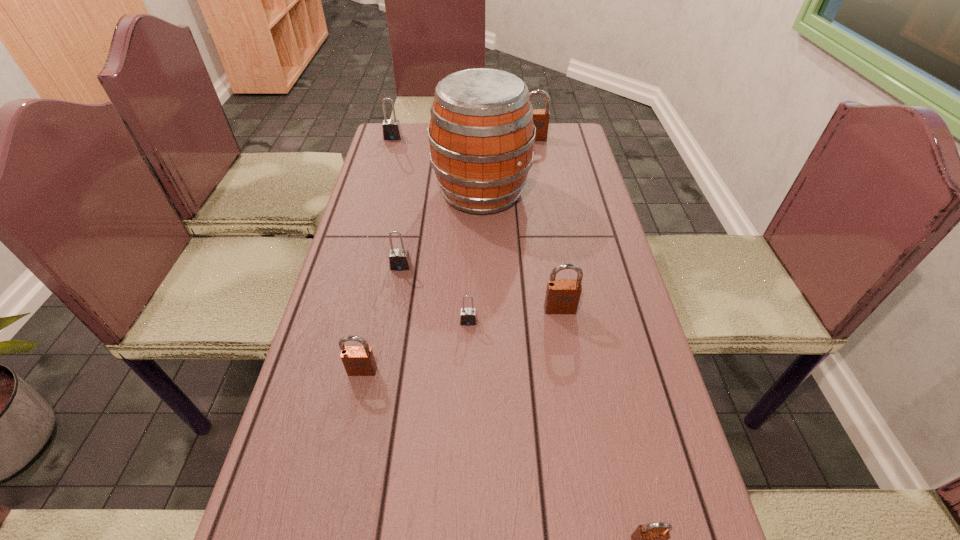
You are a GUI agent. You are given a task and a screenshot of the screen. Output one action in this format:
    pyautogui.click(x=<x>, y=<y>)
    Task: Click on the gray padlock that can be found as the closest to the second farthest brown padlock
    
    Given the screenshot: What is the action you would take?
    pyautogui.click(x=468, y=317)